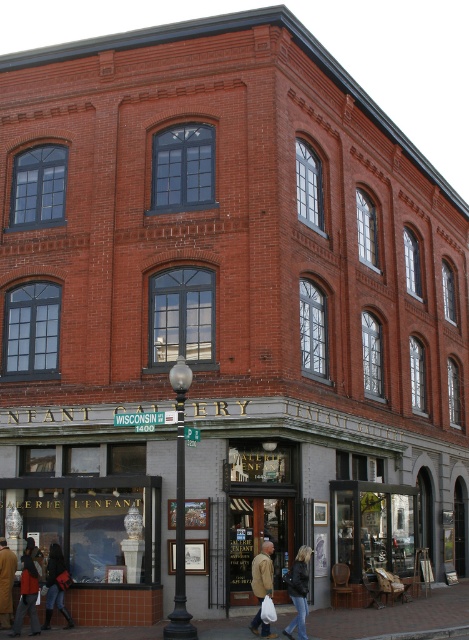
Question: Which of the following is the farthest from the observer?

Choices:
 (A) (92, 630)
 (B) (4, 620)
 (C) (54, 579)

Answer: (C)

Question: In this image, where is brick pavement at lower center located relative to black leather jacket at lower center?

Choices:
 (A) left
 (B) right

Answer: (B)

Question: Is tan leather jacket at lower center thinner than matte red coat at lower left?

Choices:
 (A) yes
 (B) no

Answer: (A)

Question: Which of the following is the closest to the observer?

Choices:
 (A) brown leather jacket at lower left
 (B) denim jacket at lower left

Answer: (B)

Question: Which of the following is the closest to the observer?

Choices:
 (A) black leather jacket at lower center
 (B) tan leather jacket at lower center

Answer: (A)

Question: Does brick pavement at lower center appear on the right side of denim jacket at lower left?

Choices:
 (A) yes
 (B) no

Answer: (A)